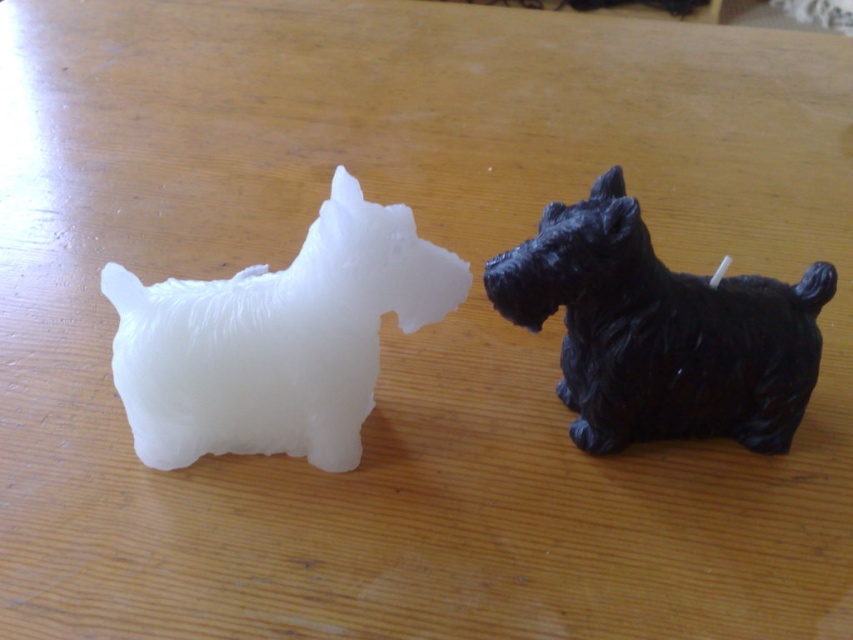
Question: Is white matte dog at left to the right of black matte dog at center from the viewer's perspective?

Choices:
 (A) yes
 (B) no

Answer: (B)

Question: Does white matte dog at left have a smaller size compared to black matte dog at center?

Choices:
 (A) no
 (B) yes

Answer: (B)

Question: Which of the following is the farthest from the observer?

Choices:
 (A) white matte dog at left
 (B) black matte dog at center

Answer: (A)

Question: Which point is farther to the camera?

Choices:
 (A) [238, 291]
 (B) [538, 292]

Answer: (A)

Question: Observing the image, what is the correct spatial positioning of white matte dog at left in reference to black matte dog at center?

Choices:
 (A) left
 (B) right

Answer: (A)